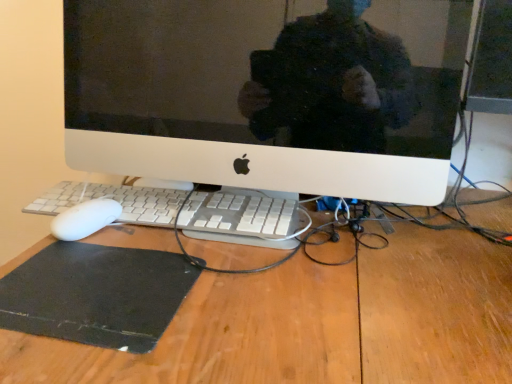
This screenshot has width=512, height=384. What are the coordinates of `vacant point to the right of white plastic keyboard at center` in the screenshot? It's located at (356, 260).